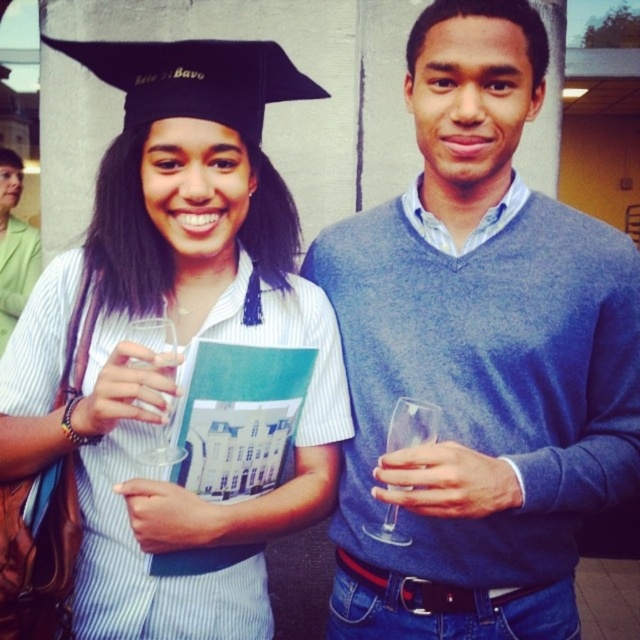
Question: Does matte black graduation cap at upper left have a smaller size compared to transparent glass at left?

Choices:
 (A) no
 (B) yes

Answer: (A)

Question: Which object is farther from the camera taking this photo?

Choices:
 (A) blue sweater at center
 (B) transparent glass wine glass at right
 (C) transparent glass at left

Answer: (B)

Question: Is matte black graduation cap at upper left wider than transparent glass wine glass at right?

Choices:
 (A) yes
 (B) no

Answer: (A)

Question: Is matte black graduation cap at upper left thinner than transparent glass wine glass at right?

Choices:
 (A) yes
 (B) no

Answer: (B)

Question: Which of these objects is positioned closest to the blue sweater at center?

Choices:
 (A) matte black graduation cap at upper left
 (B) transparent glass at left
 (C) transparent glass wine glass at right

Answer: (C)

Question: Which point is closer to the camera?

Choices:
 (A) transparent glass wine glass at right
 (B) transparent glass at left
 (C) blue sweater at center

Answer: (B)